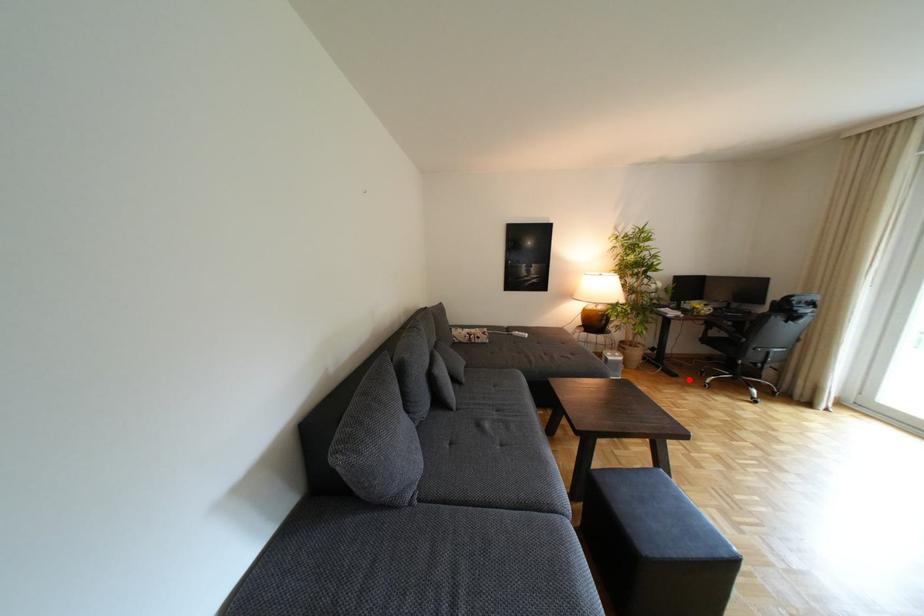
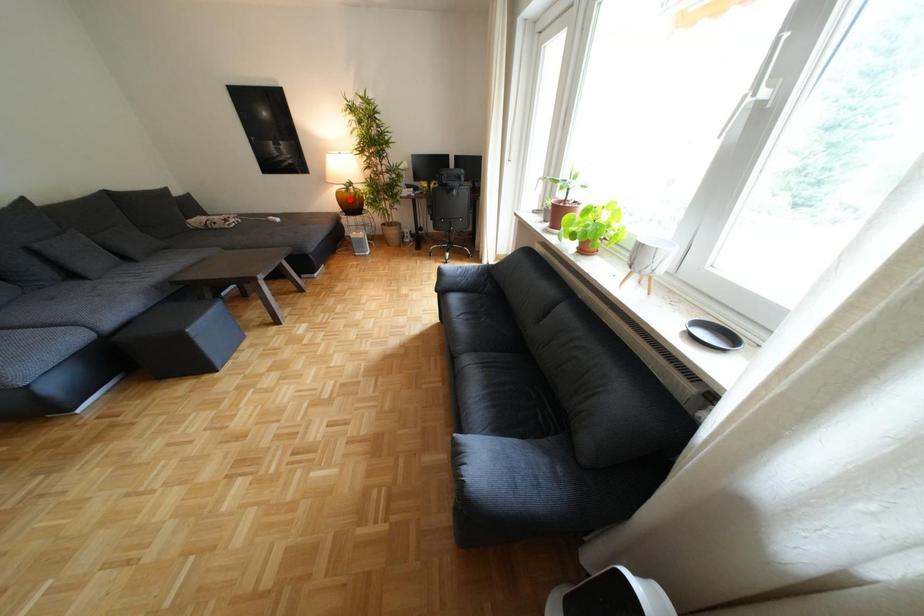
I am providing you with two images of the same scene from different viewpoints. A red point is marked on the first image and another point is marked on the second image. Do the highlighted points in image1 and image2 indicate the same real-world spot?

No